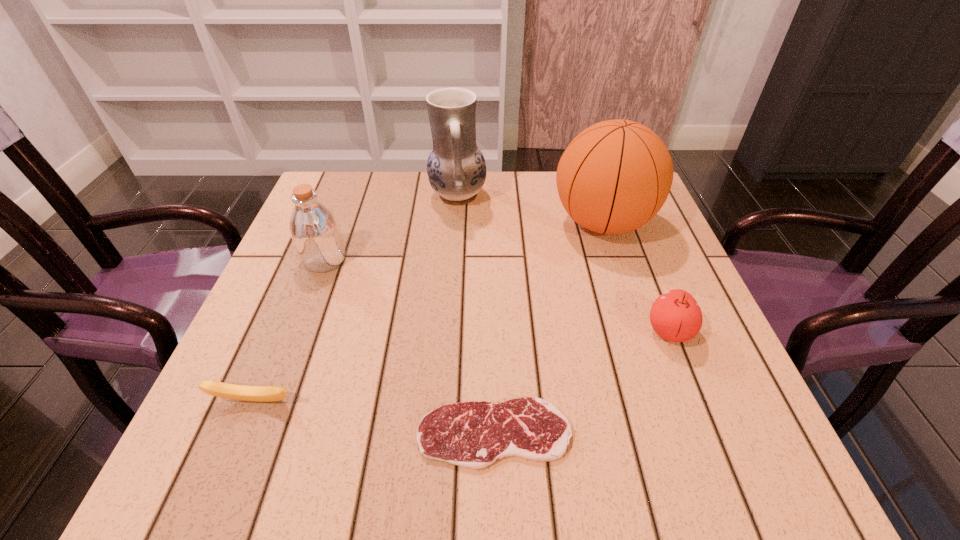
Where is `pottery`? pottery is located at coordinates (456, 168).

The image size is (960, 540). What are the coordinates of `basketball` in the screenshot? It's located at (615, 176).

Where is `bottle`? Image resolution: width=960 pixels, height=540 pixels. bottle is located at coordinates (314, 229).

Where is `the third nearest object`? Image resolution: width=960 pixels, height=540 pixels. the third nearest object is located at coordinates (675, 315).

Where is `the fourth tallest object`? This screenshot has width=960, height=540. the fourth tallest object is located at coordinates (675, 315).

You are a GUI agent. You are given a task and a screenshot of the screen. Output one action in this format:
    pyautogui.click(x=<x>, y=<y>)
    Task: Click on the banana
    This screenshot has height=540, width=960.
    Given the screenshot: What is the action you would take?
    pyautogui.click(x=219, y=389)

Image resolution: width=960 pixels, height=540 pixels. What are the coordinates of `the shortest object` in the screenshot? It's located at (474, 435).

Locate an element on the screen. vacant area located 0.270m on the left of the pottery is located at coordinates (327, 196).

The height and width of the screenshot is (540, 960). In order to click on free region located 0.100m on the front of the basketball in this screenshot , I will do `click(624, 288)`.

Identify the location of vacant space located on the front of the bottle. (255, 440).